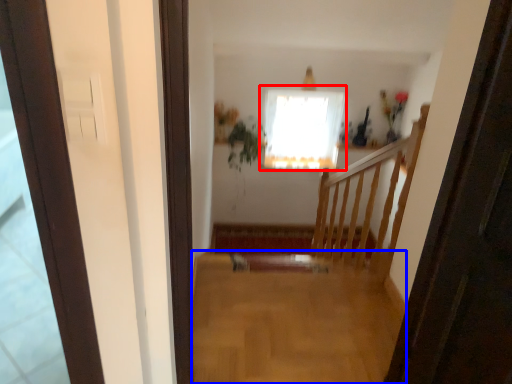
Question: Which object is closer to the camera taking this photo, window (highlighted by a red box) or plain (highlighted by a blue box)?

Choices:
 (A) window
 (B) plain

Answer: (B)